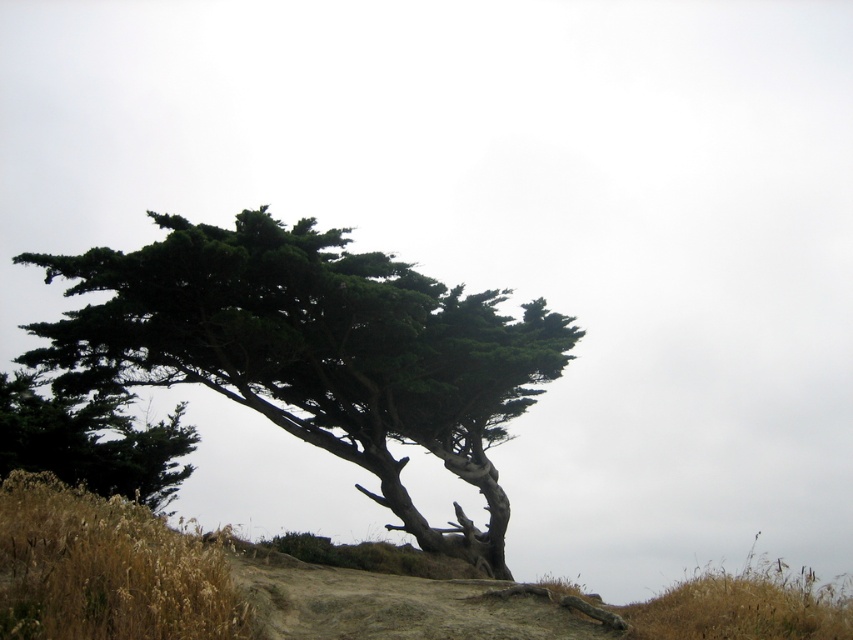
Question: Which of the following is the closest to the observer?

Choices:
 (A) green leafy tree at center
 (B) green leafy tree at left

Answer: (A)

Question: Which object is farther from the camera taking this photo?

Choices:
 (A) green leafy tree at left
 (B) green leafy tree at center

Answer: (A)

Question: Where is green leafy tree at center located in relation to green leafy tree at left in the image?

Choices:
 (A) right
 (B) left

Answer: (A)

Question: Is the position of green leafy tree at center less distant than that of green leafy tree at left?

Choices:
 (A) no
 (B) yes

Answer: (B)

Question: Does green leafy tree at center appear on the right side of green leafy tree at left?

Choices:
 (A) no
 (B) yes

Answer: (B)